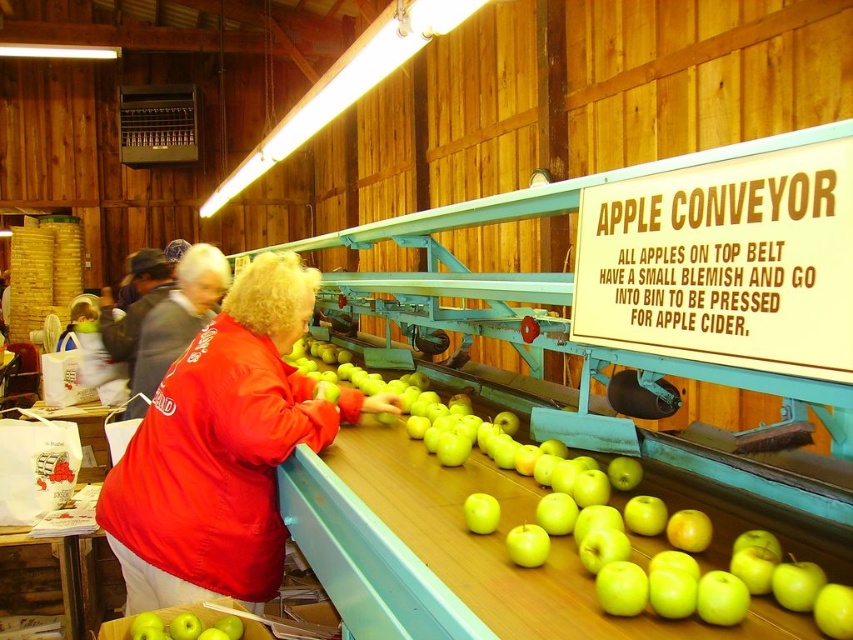
You are an apple inspector standing at the beginning of the conveyor belt. You see a red fabric jacket at center and a green matte apple at lower left on the belt. Which item is closer to your right side?

The red fabric jacket at center is positioned on the right side of the green matte apple at lower left, so the red fabric jacket at center is closer to your right side.

Based on the photo, you are an apple inspector working in the barn. You see a green shiny apple at center and a green matte apple at lower left on the conveyor belt. The apples need to be spaced at least 24 inches apart to prevent damage during transport. Do you need to adjust the spacing between them?

The green shiny apple at center and the green matte apple at lower left are 24.87 inches apart, which is more than the required 24 inches. Therefore, no adjustment is needed.